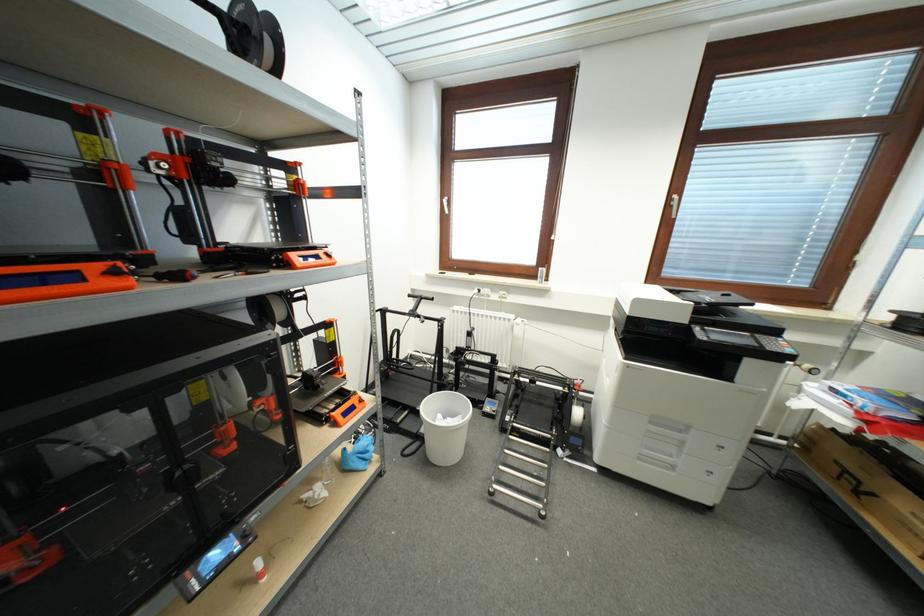
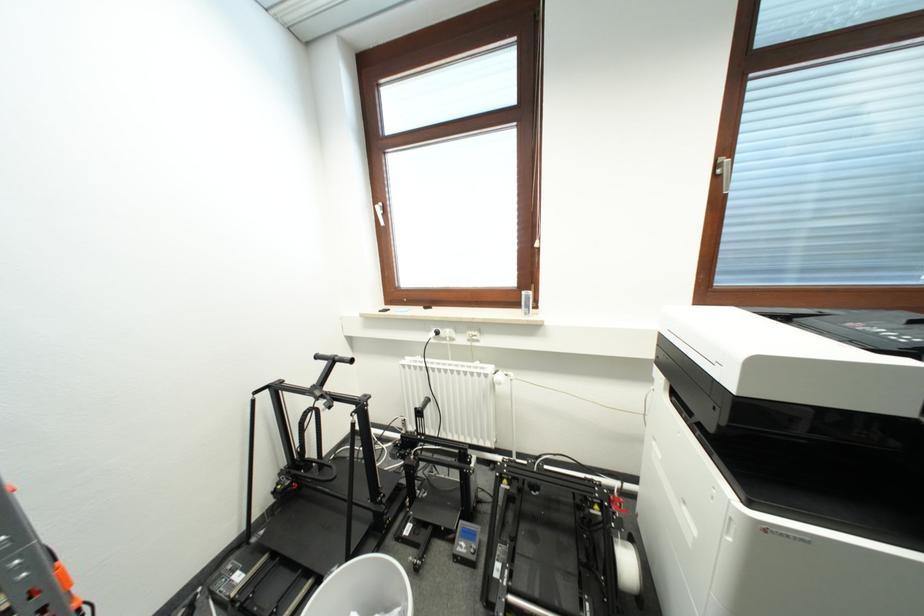
Find the pixel in the second image that matches the point at 516,318 in the first image.

(494, 371)